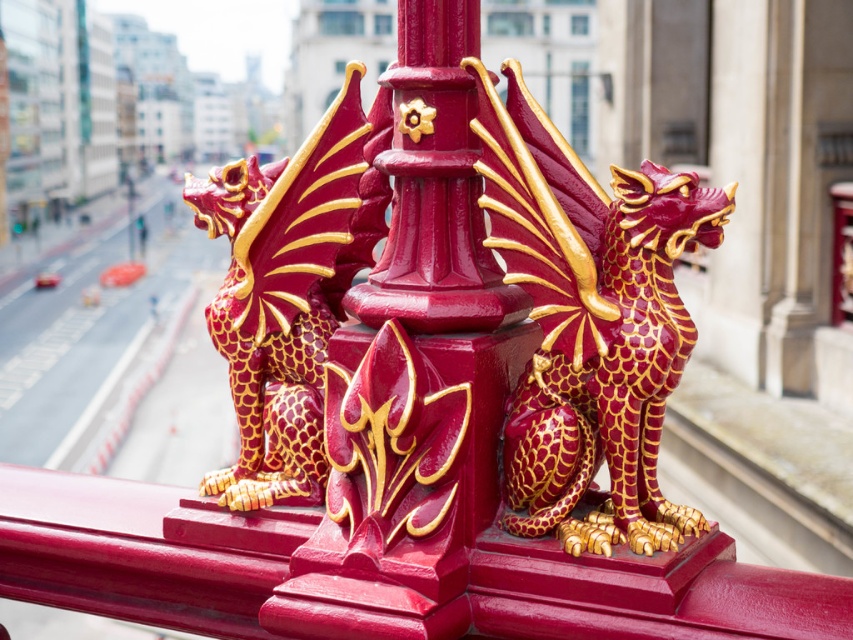
Question: Which object appears farthest from the camera in this image?

Choices:
 (A) matte gold/golden dragon at left
 (B) matte red and gold dragon at center

Answer: (A)

Question: Which of the following is the farthest from the observer?

Choices:
 (A) matte red and gold dragon at center
 (B) matte gold/golden dragon at left

Answer: (B)

Question: Is matte red and gold dragon at center above matte gold/golden dragon at left?

Choices:
 (A) yes
 (B) no

Answer: (B)

Question: Observing the image, what is the correct spatial positioning of matte red and gold dragon at center in reference to matte gold/golden dragon at left?

Choices:
 (A) left
 (B) right

Answer: (B)

Question: Is matte red and gold dragon at center to the right of matte gold/golden dragon at left from the viewer's perspective?

Choices:
 (A) yes
 (B) no

Answer: (A)

Question: Which object appears closest to the camera in this image?

Choices:
 (A) matte gold/golden dragon at left
 (B) matte red and gold dragon at center

Answer: (B)